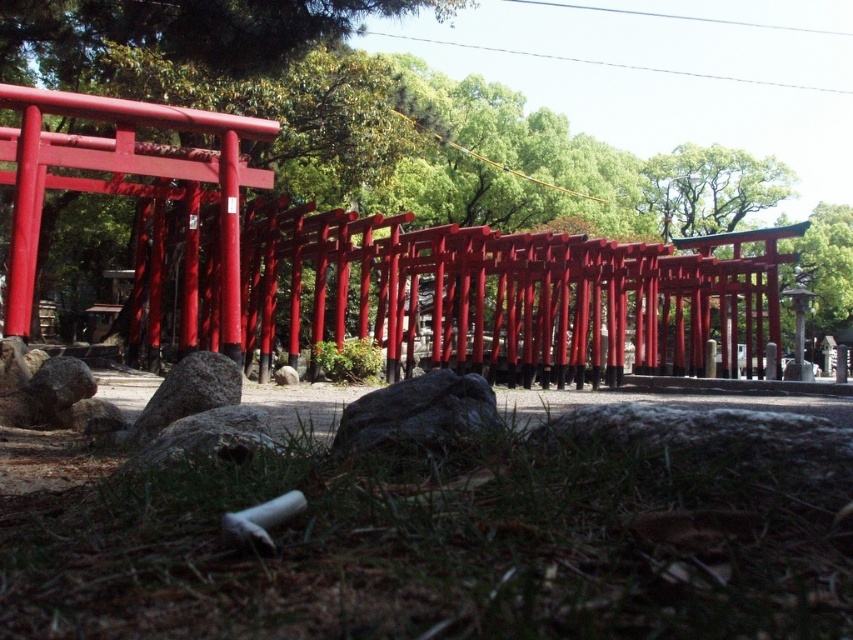
Who is lower down, green grass at lower center or gray rough rock at center?

green grass at lower center

Who is higher up, green grass at lower center or gray rough rock at center?

gray rough rock at center is above.

Does point (576, 460) lie behind point (375, 444)?

No, it is not.

The height and width of the screenshot is (640, 853). I want to click on green grass at lower center, so click(440, 548).

Looking at this image, who is more distant from viewer, (798, 554) or (239, 397)?

Positioned behind is point (239, 397).

Can you confirm if green grass at lower center is bigger than gray rough rock at lower center?

Indeed, green grass at lower center has a larger size compared to gray rough rock at lower center.

Does point (624, 410) come farther from viewer compared to point (204, 358)?

No.

Identify the location of green grass at lower center. (440, 548).

In the scene shown: Does gray rough rock at center have a greater height compared to gray rough rock at lower center?

In fact, gray rough rock at center may be shorter than gray rough rock at lower center.

Is gray rough rock at center below gray rough rock at lower center?

No.

Who is more forward, (349,413) or (219,368)?

Positioned in front is point (349,413).

Locate an element on the screen. This screenshot has height=640, width=853. gray rough rock at center is located at coordinates (416, 412).